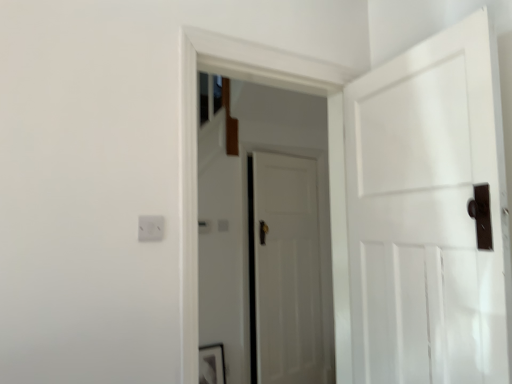
Question: Does white matte door at center, marked as the 2th door in a back-to-front arrangement, have a greater height compared to matte black picture frame at lower center?

Choices:
 (A) yes
 (B) no

Answer: (A)

Question: Is white matte door at center, marked as the 2th door in a back-to-front arrangement, shorter than matte black picture frame at lower center?

Choices:
 (A) yes
 (B) no

Answer: (B)

Question: Considering the relative sizes of white matte door at center, marked as the 2th door in a back-to-front arrangement, and matte black picture frame at lower center in the image provided, is white matte door at center, marked as the 2th door in a back-to-front arrangement, wider than matte black picture frame at lower center?

Choices:
 (A) no
 (B) yes

Answer: (B)

Question: Does white matte door at center, the 1th door from the front, have a larger size compared to matte black picture frame at lower center?

Choices:
 (A) yes
 (B) no

Answer: (A)

Question: Can you confirm if white matte door at center, marked as the 2th door in a back-to-front arrangement, is thinner than matte black picture frame at lower center?

Choices:
 (A) yes
 (B) no

Answer: (B)

Question: Considering the positions of matte black picture frame at lower center and white matte door at center, positioned as the 2th door in front-to-back order, in the image, is matte black picture frame at lower center wider or thinner than white matte door at center, positioned as the 2th door in front-to-back order,?

Choices:
 (A) wide
 (B) thin

Answer: (B)

Question: Is matte black picture frame at lower center in front of or behind white matte door at center, which is the first door from back to front, in the image?

Choices:
 (A) behind
 (B) front

Answer: (B)

Question: Is matte black picture frame at lower center inside or outside of white matte door at center, positioned as the 2th door in front-to-back order?

Choices:
 (A) inside
 (B) outside

Answer: (B)

Question: In the image, is matte black picture frame at lower center on the left side or the right side of white matte door at center, positioned as the 2th door in front-to-back order?

Choices:
 (A) left
 (B) right

Answer: (A)

Question: In the image, is matte black picture frame at lower center positioned in front of or behind white matte door at center, the 1th door from the front?

Choices:
 (A) behind
 (B) front

Answer: (A)

Question: Would you say matte black picture frame at lower center is inside or outside white matte door at center, the 1th door from the front?

Choices:
 (A) outside
 (B) inside

Answer: (A)

Question: Considering the positions of point (202, 369) and point (404, 304), is point (202, 369) closer or farther from the camera than point (404, 304)?

Choices:
 (A) closer
 (B) farther

Answer: (B)

Question: Based on their positions, is matte black picture frame at lower center located to the left or right of white matte door at center, the 1th door from the front?

Choices:
 (A) right
 (B) left

Answer: (B)

Question: Is white matte door at center, which is the first door from back to front, in front of or behind white matte door at center, marked as the 2th door in a back-to-front arrangement, in the image?

Choices:
 (A) front
 (B) behind

Answer: (B)

Question: Looking at their shapes, would you say white matte door at center, which is the first door from back to front, is wider or thinner than white matte door at center, the 1th door from the front?

Choices:
 (A) thin
 (B) wide

Answer: (B)